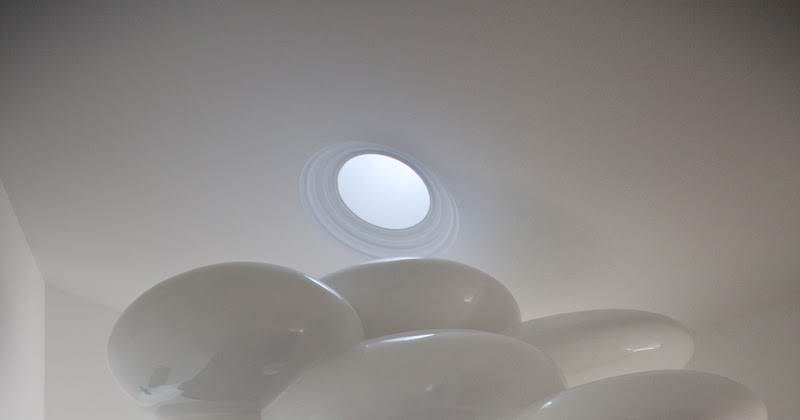
Find the location of `the left wall`. the left wall is located at coordinates (26, 281).